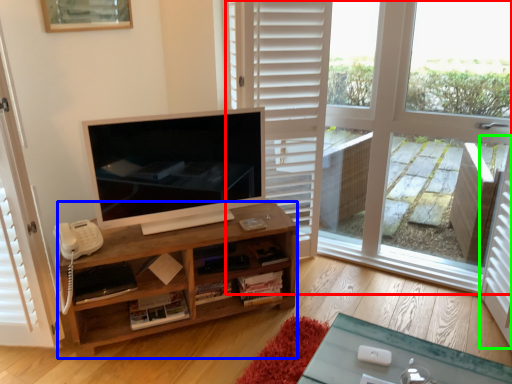
Question: Which is nearer to the window (highlighted by a red box)? cabinetry (highlighted by a blue box) or screen door (highlighted by a green box).

Choices:
 (A) cabinetry
 (B) screen door

Answer: (B)